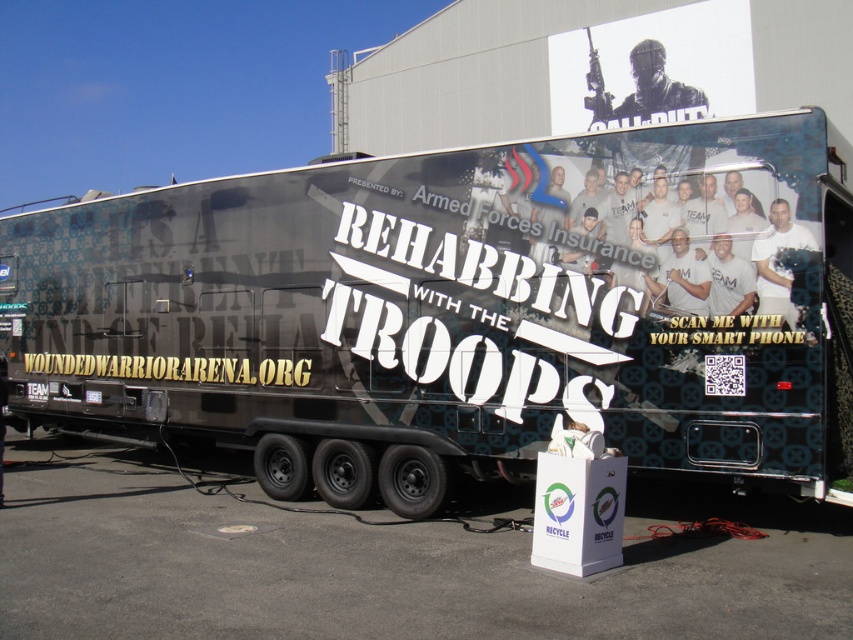
How distant is matte black trailer truck at center from white cardboard at lower center?

A distance of 1.84 meters exists between matte black trailer truck at center and white cardboard at lower center.

Which is behind, point (344, 225) or point (759, 518)?

Positioned behind is point (344, 225).

Between point (722, 332) and point (299, 570), which one is positioned behind?

Positioned behind is point (722, 332).

At what (x,y) coordinates should I click in order to perform the action: click on matte black trailer truck at center. Please return your answer as a coordinate pair (x, y). The height and width of the screenshot is (640, 853). Looking at the image, I should click on (451, 308).